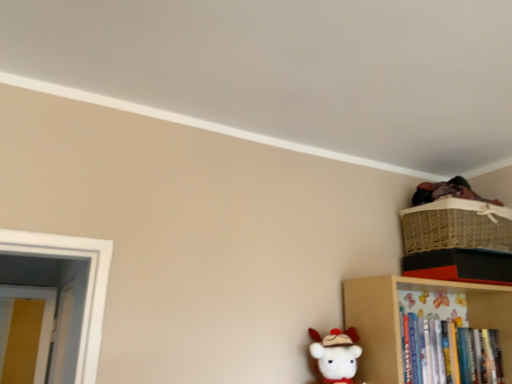
Question: From the image's perspective, is woven straw basket at upper right positioned above or below white plush toy at lower center?

Choices:
 (A) below
 (B) above

Answer: (B)

Question: In terms of width, does woven straw basket at upper right look wider or thinner when compared to white plush toy at lower center?

Choices:
 (A) wide
 (B) thin

Answer: (A)

Question: Estimate the real-world distances between objects in this image. Which object is closer to the white plush toy at lower center?

Choices:
 (A) woven straw basket at upper right
 (B) wooden bookshelf at lower right

Answer: (B)

Question: Which object is positioned farthest from the wooden bookshelf at lower right?

Choices:
 (A) white plush toy at lower center
 (B) woven straw basket at upper right

Answer: (B)